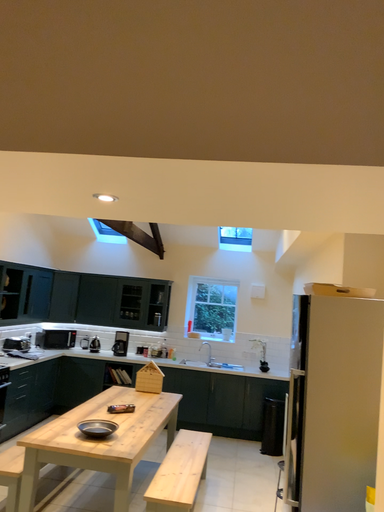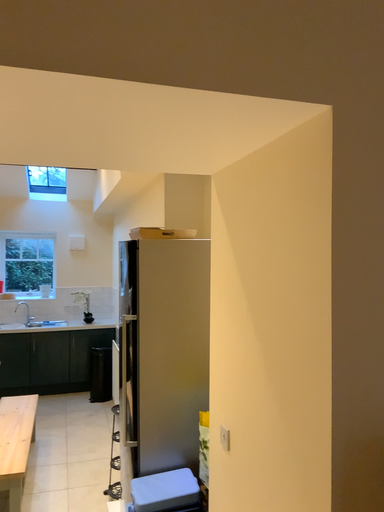
Question: Which way did the camera rotate in the video?

Choices:
 (A) rotated left
 (B) rotated right

Answer: (B)